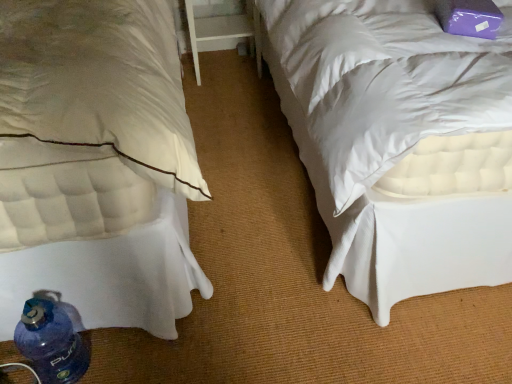
Where is `free space in front of white wood table at center`? free space in front of white wood table at center is located at coordinates (231, 96).